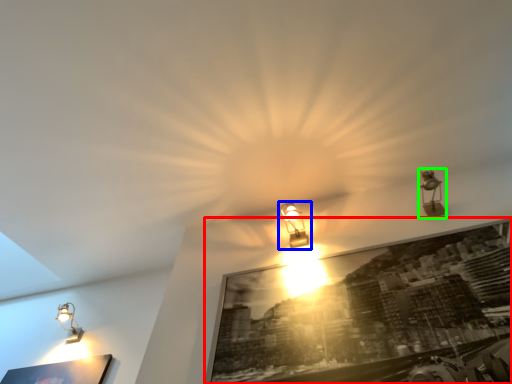
Question: Estimate the real-world distances between objects in this image. Which object is closer to picture frame (highlighted by a red box), lamp (highlighted by a blue box) or lamp (highlighted by a green box)?

Choices:
 (A) lamp
 (B) lamp

Answer: (A)